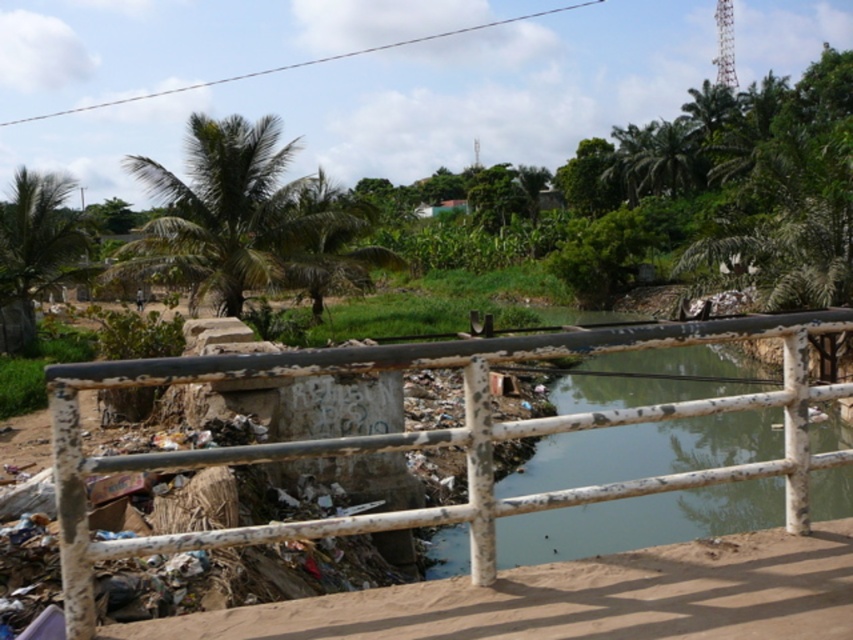
You are standing at the center of the scene. Which object is located at the point with coordinates [36,252]?

The green leafy palm tree at upper left is located at point [36,252].

You are a park maintenance worker who needs to assess the height of the white painted metal rail at center and the green leafy palm tree at upper left. Which object is taller?

The green leafy palm tree at upper left is taller than the white painted metal rail at center.

You are standing at the center of the image. Which direction should you look to see the green leafy palm tree at upper left?

The green leafy palm tree at upper left is located at the upper left direction from your current position.